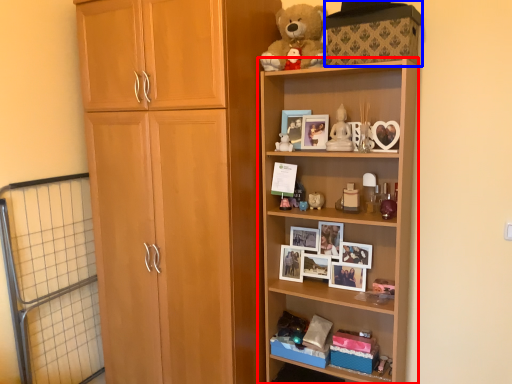
Question: Among these objects, which one is nearest to the camera, shelf (highlighted by a red box) or storage box (highlighted by a blue box)?

Choices:
 (A) shelf
 (B) storage box

Answer: (B)